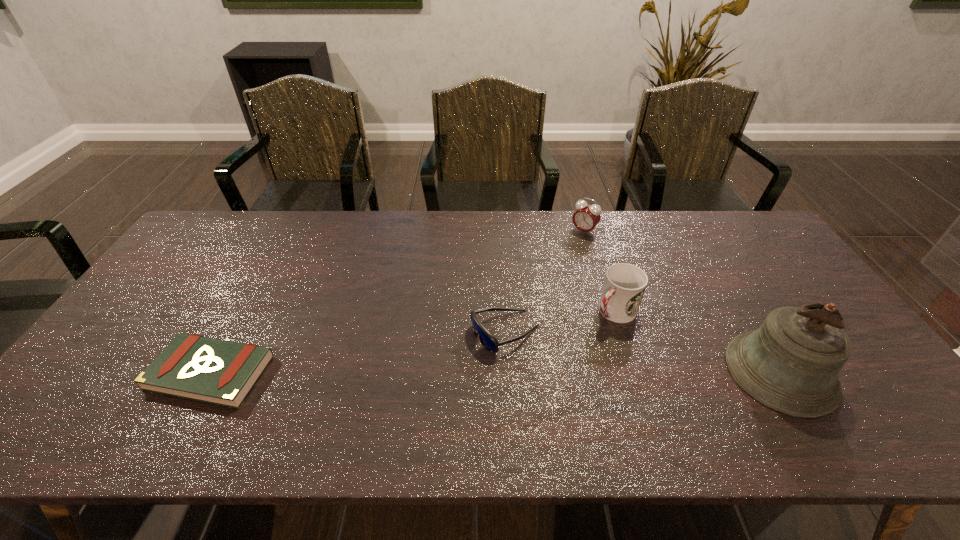
Where is `book positioned at the near edge`? book positioned at the near edge is located at coordinates (220, 372).

Find the location of `bell that is at the near edge`. bell that is at the near edge is located at coordinates (790, 364).

This screenshot has width=960, height=540. Find the location of `object situated at the right edge`. object situated at the right edge is located at coordinates (790, 364).

The image size is (960, 540). Identify the location of object at the near right corner. (790, 364).

Identify the location of free space at the far edge. This screenshot has width=960, height=540. (498, 218).

This screenshot has width=960, height=540. I want to click on free region at the near edge of the desktop, so click(x=324, y=374).

This screenshot has height=540, width=960. In the image, there is a desktop. Identify the location of vacant space at the left edge. (164, 302).

Identify the location of vacant space at the far right corner of the desktop. [x=744, y=228].

The image size is (960, 540). I want to click on free space between the fourth tallest object and the alarm clock, so click(x=544, y=282).

Locate an element on the screen. This screenshot has width=960, height=540. vacant space that is in between the fourth tallest object and the book is located at coordinates (358, 353).